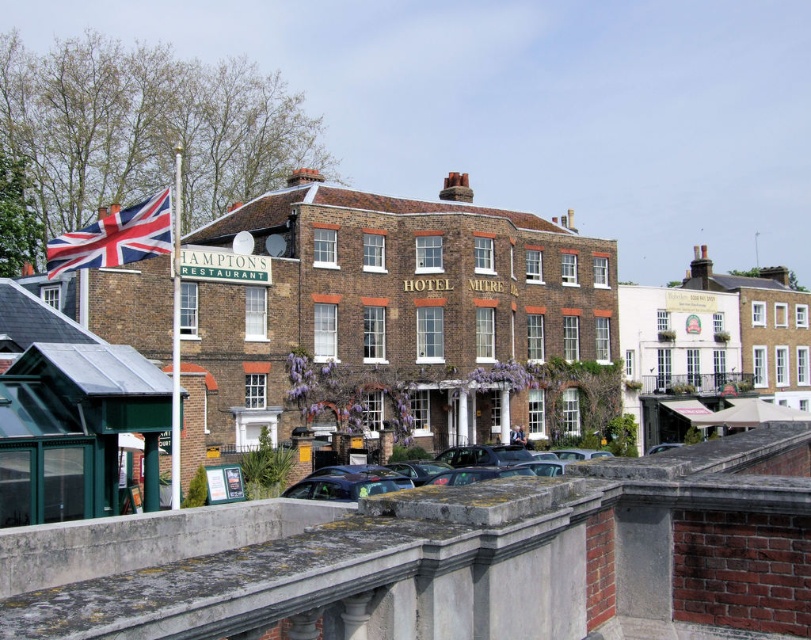
Does white painted building at upper right have a smaller size compared to white brick building at upper right?

Yes.

Does white painted building at upper right appear over white brick building at upper right?

Actually, white painted building at upper right is below white brick building at upper right.

Is point (681, 292) in front of point (779, 388)?

That is True.

Image resolution: width=811 pixels, height=640 pixels. What are the coordinates of `white painted building at upper right` in the screenshot? It's located at (676, 355).

Between point (543, 364) and point (807, 369), which one is positioned in front?

Positioned in front is point (543, 364).

Can you confirm if brown brick hotel mitre at center is bigger than white brick building at upper right?

Incorrect, brown brick hotel mitre at center is not larger than white brick building at upper right.

Between point (363, 333) and point (767, 272), which one is positioned in front?

Point (363, 333) is in front.

Locate an element on the screen. brown brick hotel mitre at center is located at coordinates point(391,316).

Between white brick building at upper right and metallic gray car at center, which one appears on the right side from the viewer's perspective?

From the viewer's perspective, white brick building at upper right appears more on the right side.

Based on the photo, which is below, white brick building at upper right or metallic gray car at center?

metallic gray car at center

The height and width of the screenshot is (640, 811). What do you see at coordinates (766, 326) in the screenshot?
I see `white brick building at upper right` at bounding box center [766, 326].

At what (x,y) coordinates should I click in order to perform the action: click on white brick building at upper right. Please return your answer as a coordinate pair (x, y). The width and height of the screenshot is (811, 640). Looking at the image, I should click on (766, 326).